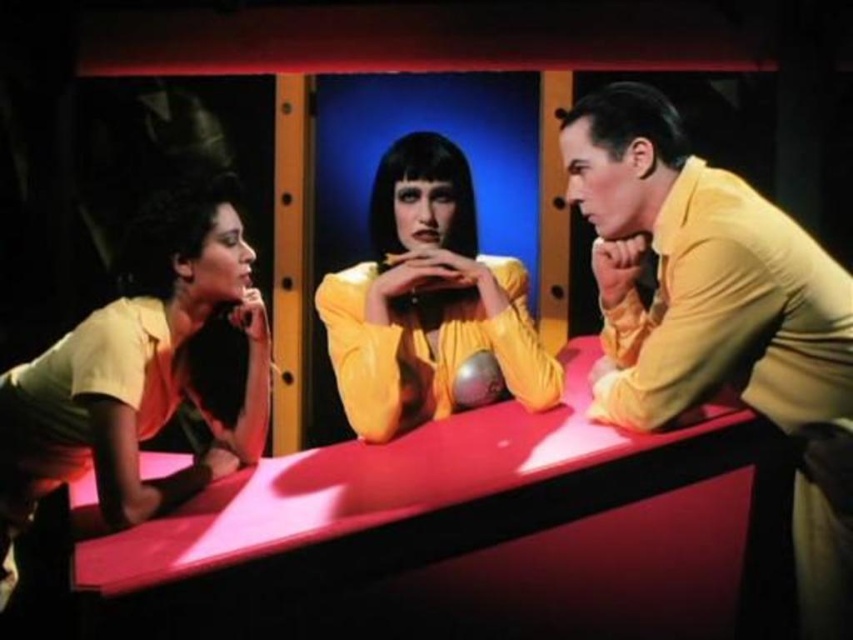
You are a customer at a bar and want to place your drink on the glossy plastic table at center. However, there is a matte yellow blouse at left nearby. Which object is closer to the right edge of the table?

The glossy plastic table at center is to the right of the matte yellow blouse at left, so the glossy plastic table at center is closer to the right edge of the table.

You are a photographer setting up a shoot at this location. You need to ensure that the glossy plastic table at center and the matte yellow blouse at left are both visible in the frame. Given their height difference, which object will appear larger in the photo?

The glossy plastic table at center is shorter than the matte yellow blouse at left, so the matte yellow blouse at left will appear larger in the photo because it is taller.

You are a fashion designer observing the three people at the red table. You notice two individuals wearing matte yellow blouses. Which one has a wider blouse, the matte yellow blouse at left or the matte yellow blouse at center?

The matte yellow blouse at left has a larger width than the matte yellow blouse at center according to the description.